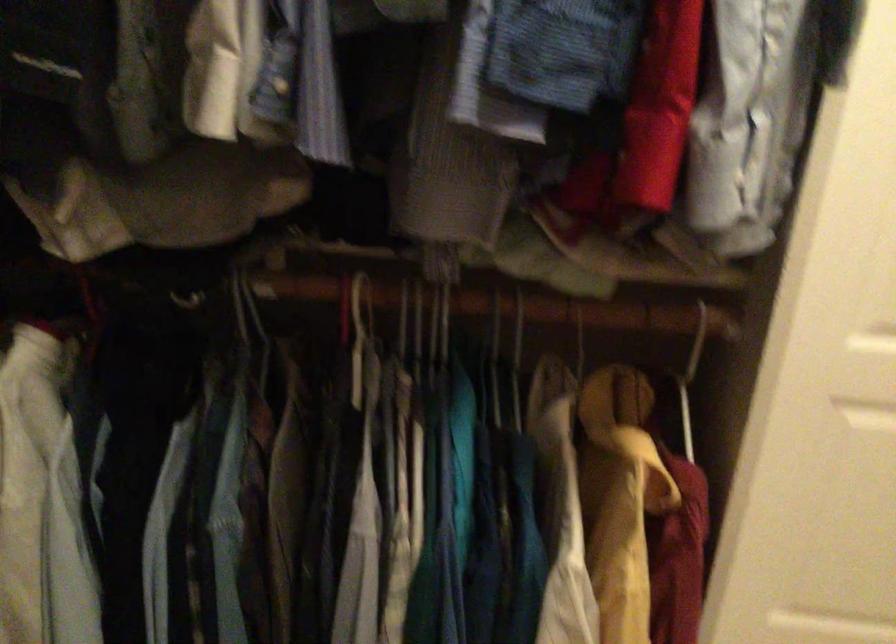
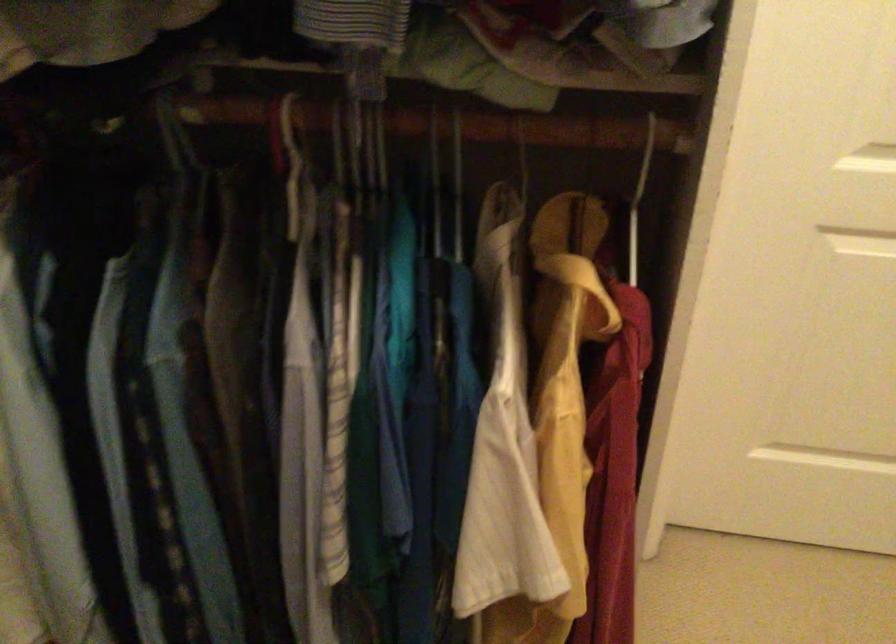
Question: In a continuous first-person perspective shot, in which direction is the camera moving?

Choices:
 (A) Left
 (B) Right
 (C) Forward
 (D) Backward

Answer: (B)